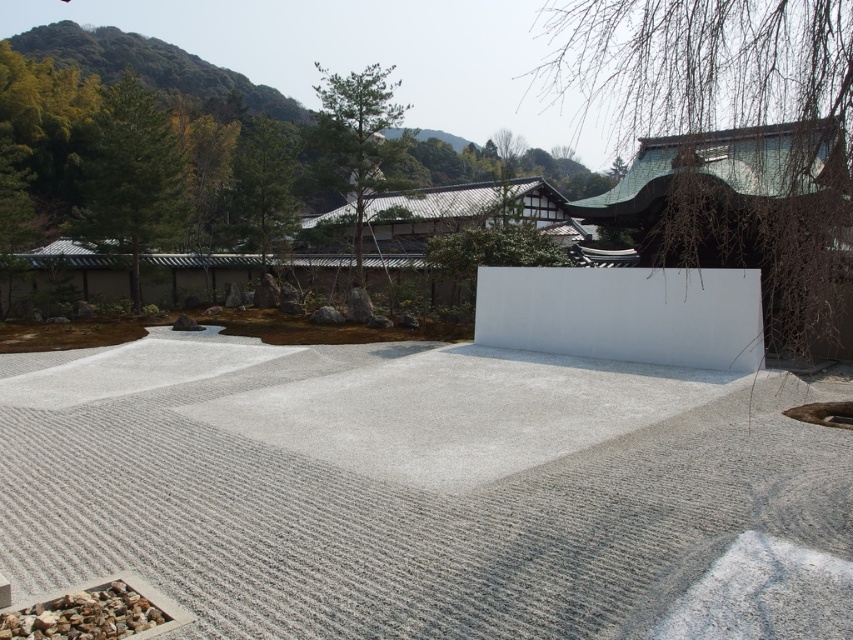
Between point (540, 316) and point (135, 172), which one is positioned behind?

The point (135, 172) is behind.

Can you confirm if white smooth concrete at center is positioned to the right of green textured pine tree at upper left?

Correct, you'll find white smooth concrete at center to the right of green textured pine tree at upper left.

The image size is (853, 640). What do you see at coordinates (625, 314) in the screenshot?
I see `white smooth concrete at center` at bounding box center [625, 314].

Image resolution: width=853 pixels, height=640 pixels. Find the location of `white smooth concrete at center`. white smooth concrete at center is located at coordinates (625, 314).

Is the position of white smooth concrete at center less distant than that of green textured tree at upper center?

Yes, it is in front of green textured tree at upper center.

Which is below, white smooth concrete at center or green textured tree at upper center?

white smooth concrete at center is lower down.

What do you see at coordinates (625, 314) in the screenshot?
I see `white smooth concrete at center` at bounding box center [625, 314].

I want to click on white smooth concrete at center, so click(x=625, y=314).

Does green textured tree at upper center come in front of gray gravel at lower left?

No, green textured tree at upper center is behind gray gravel at lower left.

Is green textured tree at upper center taller than gray gravel at lower left?

Indeed, green textured tree at upper center has a greater height compared to gray gravel at lower left.

What do you see at coordinates (263, 186) in the screenshot? Image resolution: width=853 pixels, height=640 pixels. I see `green textured tree at upper center` at bounding box center [263, 186].

Find the location of a particular element. The width and height of the screenshot is (853, 640). green textured tree at upper center is located at coordinates (263, 186).